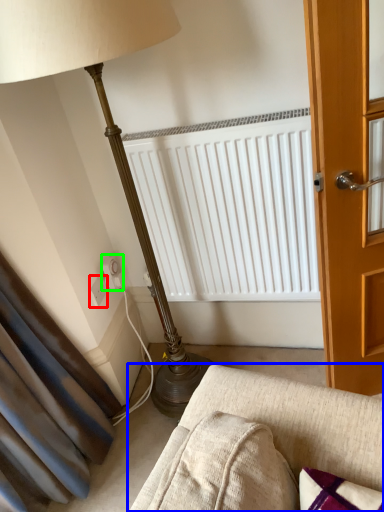
Question: Which is nearer to the electric outlet (highlighted by a red box)? studio couch (highlighted by a blue box) or electric outlet (highlighted by a green box).

Choices:
 (A) studio couch
 (B) electric outlet

Answer: (B)